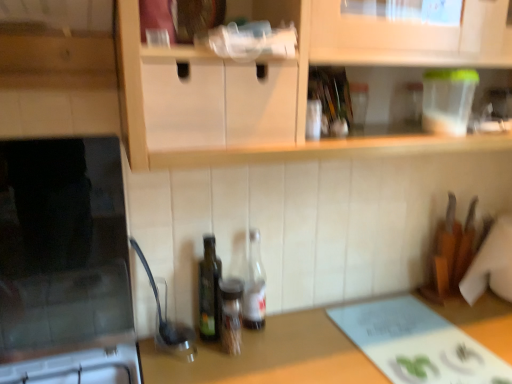
Identify the location of space that is in front of green glass bottle at center, which is counted as the first bottle, starting from the left. (208, 367).